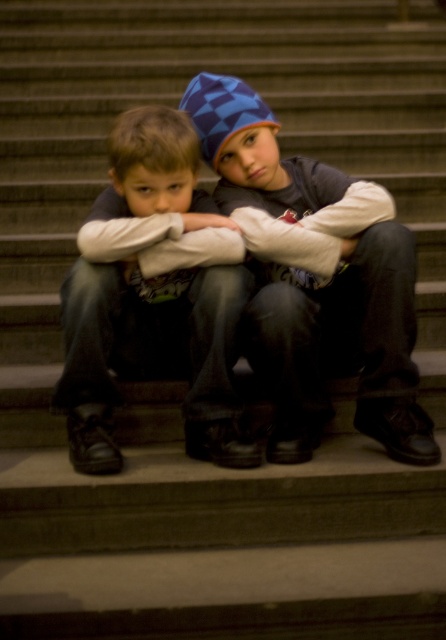
You are a photographer trying to capture a clear shot of the blue checkered beanie at center and the matte black jacket at center. Since both are at the same central position, which object should you focus on first to ensure it appears sharp in the photo?

The blue checkered beane at center has a greater height compared to the matte black jacket at center, so you should focus on the blue checkered beanie at center first to ensure it appears sharp in the photo.

You are a photographer trying to capture a candid shot of the two children on the stone steps. You notice the blue checkered beanie at center and the matte black jacket at center. Which object should you focus on first if you want to ensure both are in the frame without moving the camera?

You should focus on the matte black jacket at center first because the blue checkered beanie at center is located above it, ensuring the jacket is in the lower part of the frame while the beanie remains visible above.

Based on the photo, you are a photographer trying to capture a closeup of the blue checkered beanie at center and the matte black jacket at center. Since you want to focus on the details of both items, which one should you zoom in on more to ensure they are both in focus?

The blue checkered beanie at center is wider than the matte black jacket at center. To ensure both are in focus, you should zoom in more on the wider blue checkered beanie at center so that the smaller matte black jacket at center can also fit into the frame.